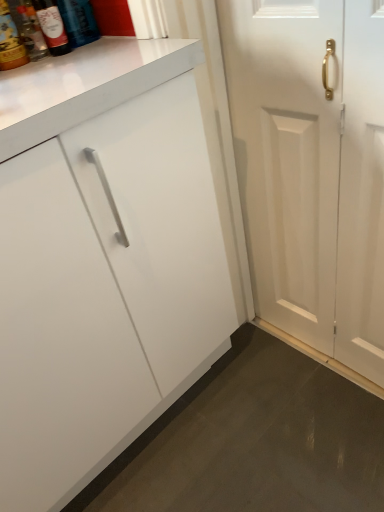
Question: From the image's perspective, is matte glass bottle at upper left, placed as the fourth bottle when sorted from right to left, located above white wooden door at right?

Choices:
 (A) yes
 (B) no

Answer: (A)

Question: Is white wooden door at right at the back of matte glass bottle at upper left, placed as the fourth bottle when sorted from right to left?

Choices:
 (A) yes
 (B) no

Answer: (B)

Question: Is matte glass bottle at upper left, which is the 1th bottle in left-to-right order, positioned beyond the bounds of white wooden door at right?

Choices:
 (A) yes
 (B) no

Answer: (A)

Question: Can you confirm if matte glass bottle at upper left, which is the 1th bottle in left-to-right order, is thinner than white wooden door at right?

Choices:
 (A) no
 (B) yes

Answer: (A)

Question: From a real-world perspective, does matte glass bottle at upper left, which is the 1th bottle in left-to-right order, stand above white wooden door at right?

Choices:
 (A) no
 (B) yes

Answer: (B)

Question: From a real-world perspective, is matte glass bottle at upper left, placed as the fourth bottle when sorted from right to left, beneath white wooden door at right?

Choices:
 (A) no
 (B) yes

Answer: (A)

Question: Does matte glass bottle at upper left, which is the third bottle from left to right, have a lesser height compared to matte glass bottle at upper left, which ranks as the 4th bottle in left-to-right order?

Choices:
 (A) yes
 (B) no

Answer: (A)

Question: Is matte glass bottle at upper left, which appears as the second bottle when viewed from the right, to the left of matte glass bottle at upper left, which ranks as the 1th bottle in right-to-left order, from the viewer's perspective?

Choices:
 (A) yes
 (B) no

Answer: (A)

Question: Does matte glass bottle at upper left, which is the third bottle from left to right, have a larger size compared to matte glass bottle at upper left, which ranks as the 1th bottle in right-to-left order?

Choices:
 (A) no
 (B) yes

Answer: (A)

Question: Is matte glass bottle at upper left, which appears as the second bottle when viewed from the right, taller than matte glass bottle at upper left, which ranks as the 4th bottle in left-to-right order?

Choices:
 (A) no
 (B) yes

Answer: (A)

Question: Is matte glass bottle at upper left, which appears as the second bottle when viewed from the right, to the right of matte glass bottle at upper left, which ranks as the 1th bottle in right-to-left order, from the viewer's perspective?

Choices:
 (A) yes
 (B) no

Answer: (B)

Question: Is matte glass bottle at upper left, which is the third bottle from left to right, smaller than matte glass bottle at upper left, which ranks as the 4th bottle in left-to-right order?

Choices:
 (A) yes
 (B) no

Answer: (A)

Question: Is white wooden door at right to the right of matte glass bottle at upper left, which ranks as the 4th bottle in left-to-right order, from the viewer's perspective?

Choices:
 (A) no
 (B) yes

Answer: (B)